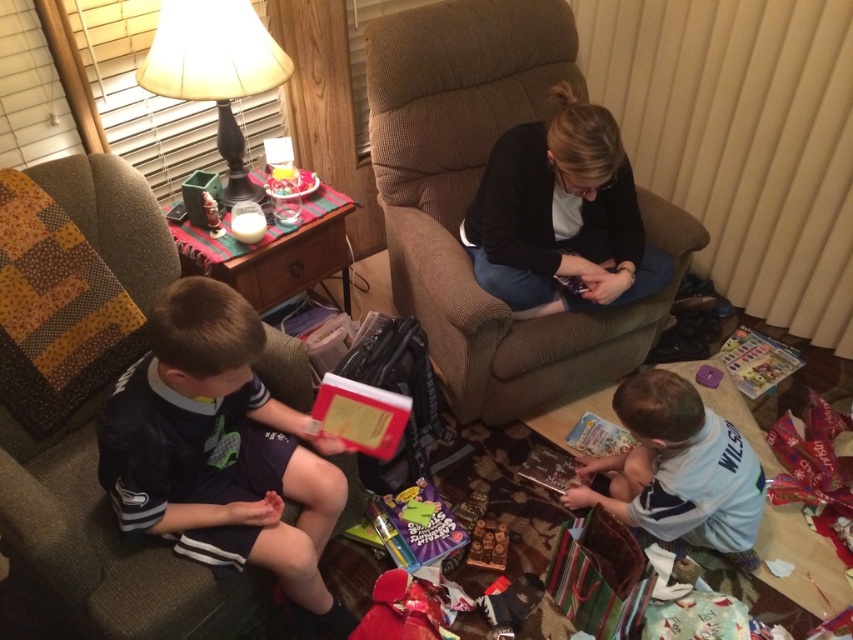
Does point (688, 445) lie in front of point (703, 381)?

Yes, it is.

Does white matte shirt at lower right appear on the left side of purple plastic toy at lower right?

Correct, you'll find white matte shirt at lower right to the left of purple plastic toy at lower right.

Is point (746, 532) farther from viewer compared to point (717, 369)?

No, it is in front of (717, 369).

Where is `white matte shirt at lower right`? The width and height of the screenshot is (853, 640). white matte shirt at lower right is located at coordinates (677, 470).

Which is more to the right, brown fabric chair at center or matte beige lampshade at upper left?

Positioned to the right is brown fabric chair at center.

Is brown fabric chair at center positioned at the back of matte beige lampshade at upper left?

Yes, brown fabric chair at center is behind matte beige lampshade at upper left.

Does point (515, 8) lie behind point (239, 1)?

Yes, point (515, 8) is farther from viewer.

The image size is (853, 640). What are the coordinates of `brown fabric chair at center` in the screenshot? It's located at (474, 195).

Can you confirm if matte beige lampshade at upper left is positioned below wooden toy at lower center?

No, matte beige lampshade at upper left is not below wooden toy at lower center.

Looking at this image, which is more to the right, matte beige lampshade at upper left or wooden toy at lower center?

wooden toy at lower center is more to the right.

Between point (202, 33) and point (479, 560), which one is positioned behind?

The point (479, 560) is more distant.

Where is `matte beige lampshade at upper left`? The image size is (853, 640). matte beige lampshade at upper left is located at coordinates (215, 70).